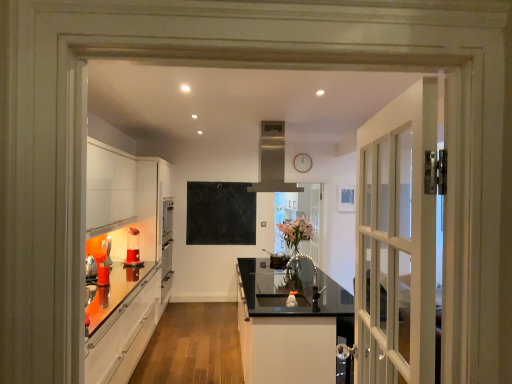
This screenshot has width=512, height=384. I want to click on black matte chalkboard at center, so click(x=220, y=213).

Locate an element on the screen. The height and width of the screenshot is (384, 512). black matte chalkboard at center is located at coordinates (220, 213).

Can you see metallic silver faucet at center, acting as the third appliance starting from the left, touching brushed metal kettle at left, acting as the 3th appliance starting from the right?

They are not placed beside each other.

Which object is more forward, metallic silver faucet at center, positioned as the 3th appliance in back-to-front order, or brushed metal kettle at left, which appears as the 2th appliance when viewed from the back?

metallic silver faucet at center, positioned as the 3th appliance in back-to-front order, is in front.

What's the angular difference between metallic silver faucet at center, the first appliance viewed from the front, and brushed metal kettle at left, acting as the 3th appliance starting from the right,'s facing directions?

The angular difference between metallic silver faucet at center, the first appliance viewed from the front, and brushed metal kettle at left, acting as the 3th appliance starting from the right, is 175 degrees.

Does metallic silver faucet at center, positioned as the 3th appliance in back-to-front order, appear on the right side of brushed metal kettle at left, acting as the 3th appliance starting from the right?

Yes.

Which is behind, brushed metal kettle at left, which is counted as the 2th appliance, starting from the front, or clear glass door at center?

clear glass door at center is further from the camera.

From the image's perspective, would you say brushed metal kettle at left, which appears as the 2th appliance when viewed from the back, is positioned over clear glass door at center?

No.

Is clear glass door at center positioned in front of metallic silver faucet at center, acting as the third appliance starting from the left?

No.

Starting from the clear glass door at center, which appliance is the 1st one to the left? Please provide its 2D coordinates.

[(303, 269)]

How different are the orientations of clear glass door at center and metallic silver faucet at center, which ranks as the first appliance in right-to-left order, in degrees?

88.9 degrees.

Between point (307, 183) and point (305, 274), which one is positioned in front?

The point (305, 274) is closer.

Would you consider brushed metal kettle at left, placed as the first appliance when sorted from left to right, to be distant from black matte chalkboard at center?

brushed metal kettle at left, placed as the first appliance when sorted from left to right, is far away from black matte chalkboard at center.

Looking at this image, considering the relative positions of brushed metal kettle at left, placed as the first appliance when sorted from left to right, and black matte chalkboard at center in the image provided, is brushed metal kettle at left, placed as the first appliance when sorted from left to right, in front of black matte chalkboard at center?

Yes, it is.

This screenshot has width=512, height=384. I want to click on bulletin board on the right of the brushed metal kettle at left, which appears as the 2th appliance when viewed from the back, so click(220, 213).

Is point (106, 238) farther from camera compared to point (232, 225)?

No.

Based on the photo, is satin silver exhaust hood at upper center surrounded by brushed metal kettle at left, acting as the 3th appliance starting from the right?

No, satin silver exhaust hood at upper center is not surrounded by brushed metal kettle at left, acting as the 3th appliance starting from the right.

Is there a large distance between brushed metal kettle at left, acting as the 3th appliance starting from the right, and satin silver exhaust hood at upper center?

Yes.

Looking at their sizes, would you say brushed metal kettle at left, which is counted as the 2th appliance, starting from the front, is wider or thinner than satin silver exhaust hood at upper center?

Considering their sizes, brushed metal kettle at left, which is counted as the 2th appliance, starting from the front, looks slimmer than satin silver exhaust hood at upper center.

In the scene shown: Can you tell me how much brushed metal kettle at left, which is counted as the 2th appliance, starting from the front, and satin silver exhaust hood at upper center differ in facing direction?

The angular difference between brushed metal kettle at left, which is counted as the 2th appliance, starting from the front, and satin silver exhaust hood at upper center is 3.61 degrees.

From a real-world perspective, which is physically below, translucent plastic blender at lower left, acting as the 1th appliance starting from the back, or black matte chalkboard at center?

In real-world perspective, translucent plastic blender at lower left, acting as the 1th appliance starting from the back, is lower.

Is translucent plastic blender at lower left, acting as the 3th appliance starting from the front, far away from black matte chalkboard at center?

Absolutely, translucent plastic blender at lower left, acting as the 3th appliance starting from the front, is distant from black matte chalkboard at center.

From the image's perspective, would you say translucent plastic blender at lower left, the 2th appliance viewed from the left, is shown under black matte chalkboard at center?

Yes.

Looking at the image, does translucent plastic blender at lower left, the second appliance viewed from the right, seem bigger or smaller compared to black matte chalkboard at center?

In the image, translucent plastic blender at lower left, the second appliance viewed from the right, appears to be smaller than black matte chalkboard at center.

Which of these two, translucent plastic blender at lower left, acting as the 3th appliance starting from the front, or brushed metal kettle at left, which appears as the 2th appliance when viewed from the back, is bigger?

With larger size is translucent plastic blender at lower left, acting as the 3th appliance starting from the front.

Is translucent plastic blender at lower left, acting as the 1th appliance starting from the back, further to camera compared to brushed metal kettle at left, placed as the first appliance when sorted from left to right?

Yes, translucent plastic blender at lower left, acting as the 1th appliance starting from the back, is behind brushed metal kettle at left, placed as the first appliance when sorted from left to right.

From a real-world perspective, which object stands above the other?

From a 3D spatial view, translucent plastic blender at lower left, acting as the 3th appliance starting from the front, is above.

What are the coordinates of `appliance that is the 1st object located above the brushed metal kettle at left, which appears as the 2th appliance when viewed from the back (from the image's perspective)` in the screenshot? It's located at (303, 269).

From a real-world perspective, which appliance is the 3rd one underneath the clear glass door at center? Please provide its 2D coordinates.

[(106, 251)]

Which object lies further to the anchor point glossy black countertop at center, translucent plastic blender at lower left, the 2th appliance viewed from the left, or black matte chalkboard at center?

translucent plastic blender at lower left, the 2th appliance viewed from the left, lies further to glossy black countertop at center than the other object.

Consider the image. Looking at the image, which one is located further to translucent plastic blender at lower left, the 2th appliance viewed from the left, satin silver exhaust hood at upper center or clear glass door at center?

Among the two, clear glass door at center is located further to translucent plastic blender at lower left, the 2th appliance viewed from the left.

Which object lies further to the anchor point brushed metal kettle at left, placed as the first appliance when sorted from left to right, satin silver exhaust hood at upper center or clear glass door at center?

Among the two, clear glass door at center is located further to brushed metal kettle at left, placed as the first appliance when sorted from left to right.

Based on their spatial positions, is metallic silver faucet at center, positioned as the 3th appliance in back-to-front order, or black matte chalkboard at center further from satin silver exhaust hood at upper center?

black matte chalkboard at center lies further to satin silver exhaust hood at upper center than the other object.

When comparing their distances from satin silver exhaust hood at upper center, does metallic silver faucet at center, positioned as the 3th appliance in back-to-front order, or glossy black countertop at center seem further?

metallic silver faucet at center, positioned as the 3th appliance in back-to-front order, is positioned further to the anchor satin silver exhaust hood at upper center.

Looking at this image, based on their spatial positions, is metallic silver faucet at center, positioned as the 3th appliance in back-to-front order, or satin silver exhaust hood at upper center closer to clear glass door at center?

metallic silver faucet at center, positioned as the 3th appliance in back-to-front order, is positioned closer to the anchor clear glass door at center.

From the image, which object appears to be farther from translucent plastic blender at lower left, the second appliance viewed from the right, clear glass door at center or satin silver exhaust hood at upper center?

The object further to translucent plastic blender at lower left, the second appliance viewed from the right, is clear glass door at center.

Considering their positions, is black matte chalkboard at center positioned further to clear glass door at center than translucent plastic blender at lower left, the 2th appliance viewed from the left?

Based on the image, translucent plastic blender at lower left, the 2th appliance viewed from the left, appears to be further to clear glass door at center.

This screenshot has width=512, height=384. I want to click on exhaust hood located between metallic silver faucet at center, acting as the third appliance starting from the left, and black matte chalkboard at center in the depth direction, so click(x=272, y=160).

Find the location of a particular element. This screenshot has height=384, width=512. bulletin board between brushed metal kettle at left, placed as the first appliance when sorted from left to right, and clear glass door at center from left to right is located at coordinates (220, 213).

Where is `exhaust hood situated between brushed metal kettle at left, acting as the 3th appliance starting from the right, and metallic silver faucet at center, which ranks as the first appliance in right-to-left order, from left to right`? Image resolution: width=512 pixels, height=384 pixels. exhaust hood situated between brushed metal kettle at left, acting as the 3th appliance starting from the right, and metallic silver faucet at center, which ranks as the first appliance in right-to-left order, from left to right is located at coordinates (272, 160).

Identify the location of appliance located between brushed metal kettle at left, placed as the first appliance when sorted from left to right, and satin silver exhaust hood at upper center in the left-right direction. (133, 248).